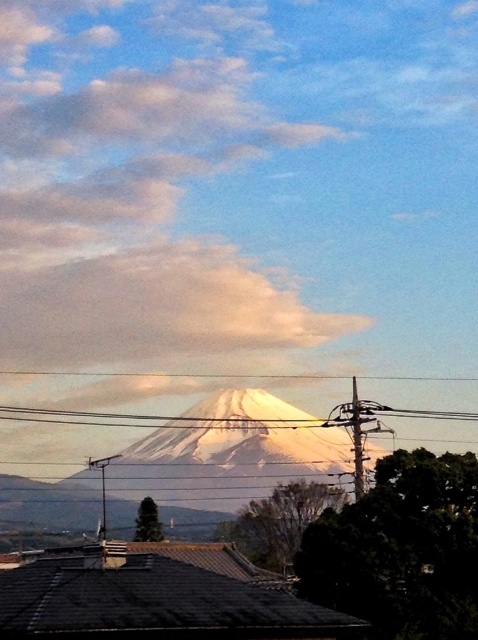
You are standing at the base of Mount Fuji and see two points in the scene. The first is point (8, 324) and the second is point (195, 428). Which point is closer to you?

Point (195, 428) is closer to you because point (8, 324) is behind it.